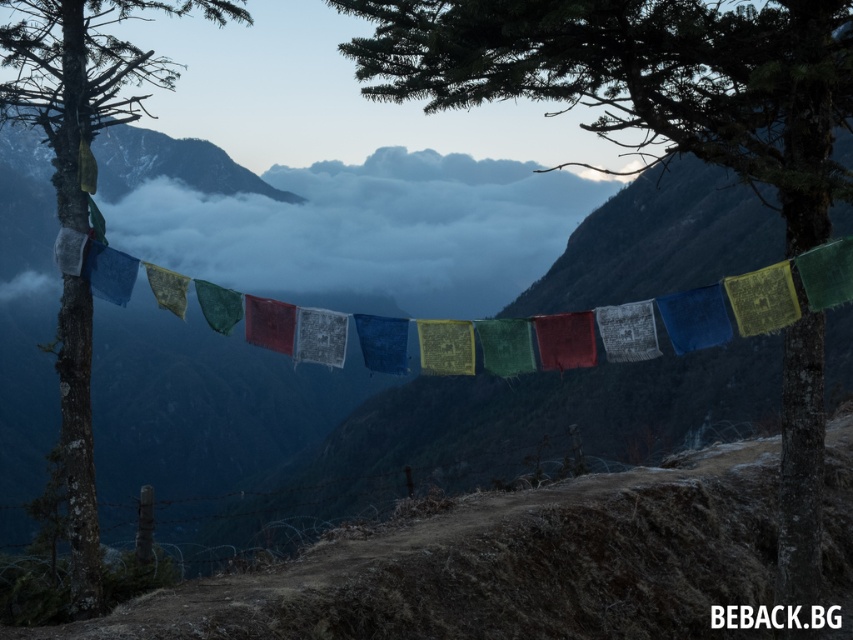
Question: Is green textured flag at center to the right of smooth bark tree at left from the viewer's perspective?

Choices:
 (A) no
 (B) yes

Answer: (B)

Question: Which of the following is the farthest from the observer?

Choices:
 (A) (786, 76)
 (B) (442, 256)

Answer: (B)

Question: From the image, what is the correct spatial relationship of green textured flag at center in relation to smooth bark tree at left?

Choices:
 (A) below
 (B) above

Answer: (A)

Question: Among these points, which one is nearest to the camera?

Choices:
 (A) (575, 33)
 (B) (486, 301)

Answer: (A)

Question: Does green textured flag at center have a lesser width compared to smooth bark tree at left?

Choices:
 (A) no
 (B) yes

Answer: (B)

Question: Which of the following is the closest to the observer?

Choices:
 (A) (103, 70)
 (B) (712, 92)
 (C) (270, 211)

Answer: (B)